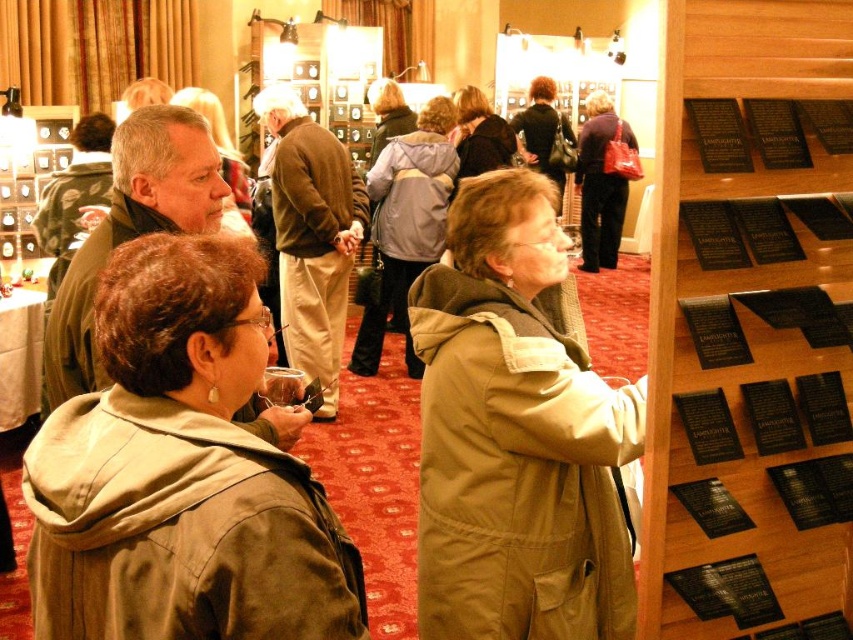
You are an event organizer who needs to arrange two garments on a display stand. You have a tan fabric trench coat at center and a brown leather jacket at center. Given their sizes, which garment should you place on the lower shelf if the lower shelf is designed for smaller items?

The tan fabric trench coat at center has a smaller size compared to the brown leather jacket at center, so it should be placed on the lower shelf designated for smaller items.